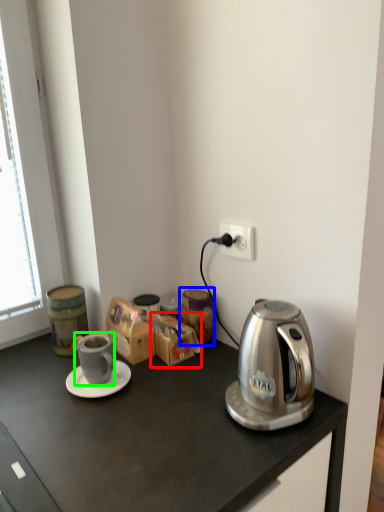
Question: Which object is the farthest from cardboard box (highlighted by a red box)? Choose among these: appliance (highlighted by a blue box) or coffee cup (highlighted by a green box).

Choices:
 (A) appliance
 (B) coffee cup

Answer: (B)